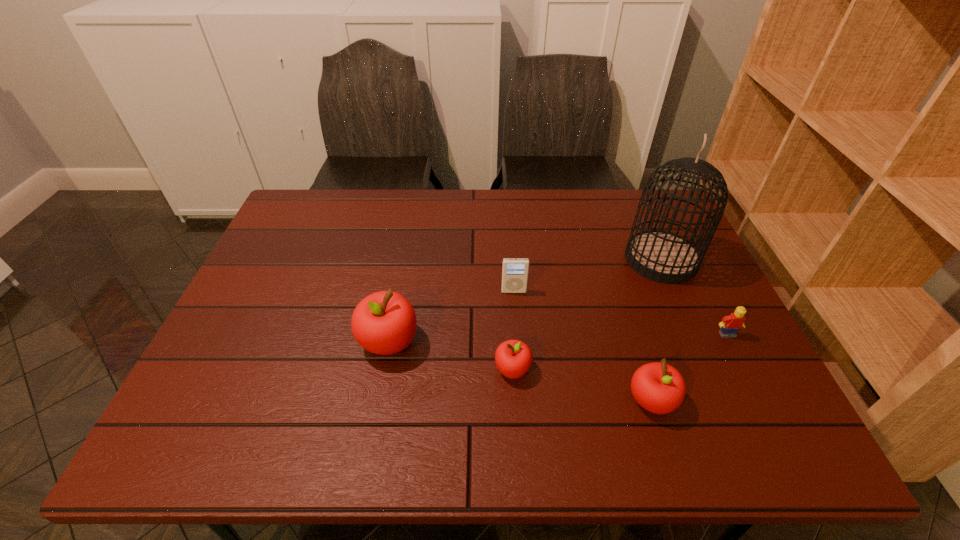
The width and height of the screenshot is (960, 540). Find the location of `vacant space at the far right corner`. vacant space at the far right corner is located at coordinates (631, 190).

The image size is (960, 540). In order to click on free space between the shortest apple and the birdcage in this screenshot , I will do `click(587, 315)`.

Image resolution: width=960 pixels, height=540 pixels. What are the coordinates of `blank region between the Lego and the second apple from left to right` in the screenshot? It's located at (620, 352).

Find the location of a particular element. The height and width of the screenshot is (540, 960). vacant area that lies between the second tallest apple and the fifth nearest object is located at coordinates (583, 346).

The image size is (960, 540). In order to click on vacant space in between the second apple from left to right and the iPod in this screenshot , I will do `click(514, 330)`.

At what (x,y) coordinates should I click in order to perform the action: click on vacant area between the rightmost apple and the iPod. Please return your answer as a coordinate pair (x, y). The height and width of the screenshot is (540, 960). Looking at the image, I should click on (583, 346).

At what (x,y) coordinates should I click in order to perform the action: click on free area in between the birdcage and the second farthest object. Please return your answer as a coordinate pair (x, y). Looking at the image, I should click on tap(588, 275).

This screenshot has height=540, width=960. I want to click on empty space that is in between the rightmost apple and the birdcage, so click(656, 330).

Where is `vacant area that lies between the iPod and the shortest apple`? This screenshot has width=960, height=540. vacant area that lies between the iPod and the shortest apple is located at coordinates (514, 330).

Locate an element on the screen. This screenshot has width=960, height=540. free space between the Lego and the second farthest object is located at coordinates (620, 313).